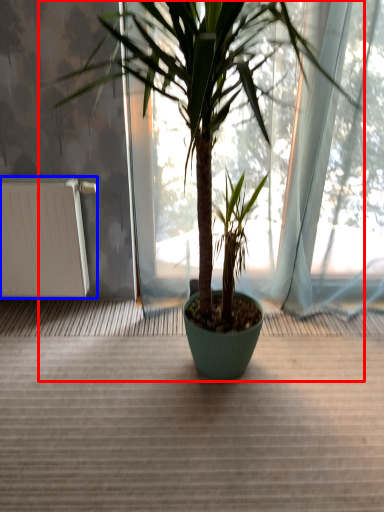
Question: Which of the following is the closest to the observer, houseplant (highlighted by a red box) or radiator (highlighted by a blue box)?

Choices:
 (A) houseplant
 (B) radiator

Answer: (A)